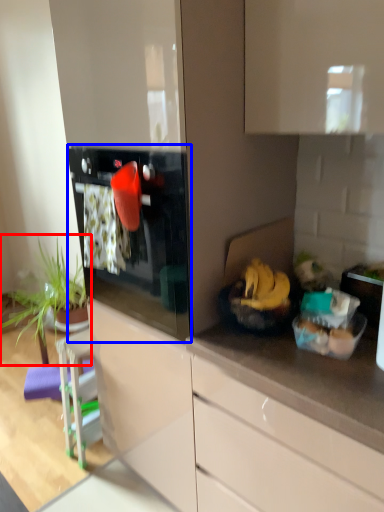
Question: Which of the following is the closest to the observer, houseplant (highlighted by a red box) or oven (highlighted by a blue box)?

Choices:
 (A) houseplant
 (B) oven

Answer: (B)